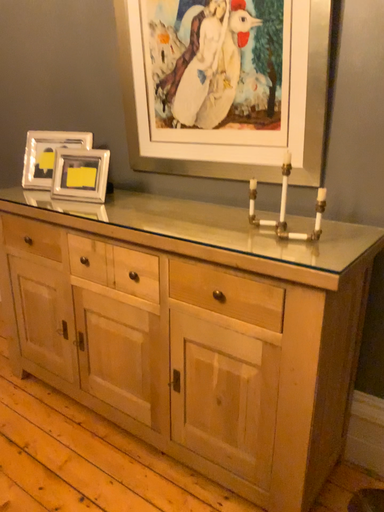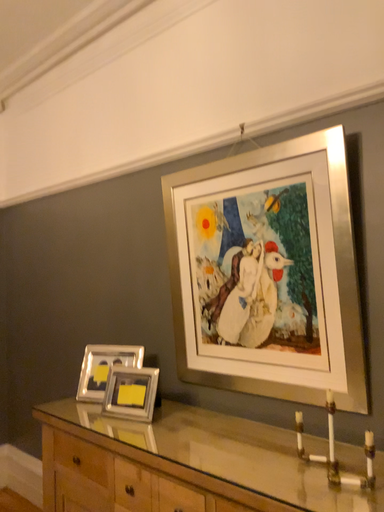
Question: Which way did the camera rotate in the video?

Choices:
 (A) rotated right
 (B) rotated left

Answer: (B)